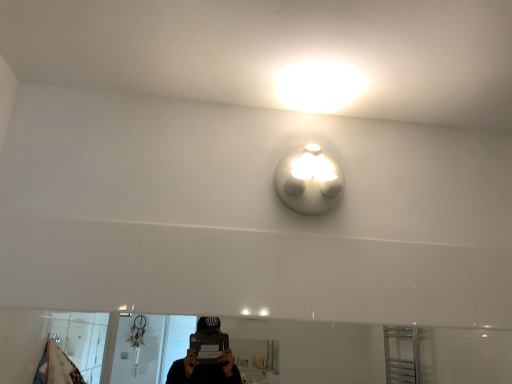
Question: From the image's perspective, is white glossy mirror at lower center below white matte light fixture at upper center?

Choices:
 (A) yes
 (B) no

Answer: (A)

Question: Can you confirm if white glossy mirror at lower center is thinner than white matte light fixture at upper center?

Choices:
 (A) no
 (B) yes

Answer: (B)

Question: From the image's perspective, is white glossy mirror at lower center over white matte light fixture at upper center?

Choices:
 (A) yes
 (B) no

Answer: (B)

Question: Does white glossy mirror at lower center have a greater width compared to white matte light fixture at upper center?

Choices:
 (A) yes
 (B) no

Answer: (B)

Question: Is white glossy mirror at lower center to the left of white matte light fixture at upper center from the viewer's perspective?

Choices:
 (A) yes
 (B) no

Answer: (A)

Question: Considering the relative sizes of white glossy mirror at lower center and white matte light fixture at upper center in the image provided, is white glossy mirror at lower center shorter than white matte light fixture at upper center?

Choices:
 (A) yes
 (B) no

Answer: (A)

Question: Is white matte light fixture at upper center shorter than white glossy mirror at lower center?

Choices:
 (A) no
 (B) yes

Answer: (A)

Question: Can you confirm if white matte light fixture at upper center is bigger than white glossy mirror at lower center?

Choices:
 (A) yes
 (B) no

Answer: (B)

Question: Can you confirm if white matte light fixture at upper center is smaller than white glossy mirror at lower center?

Choices:
 (A) no
 (B) yes

Answer: (B)

Question: Can you confirm if white matte light fixture at upper center is thinner than white glossy mirror at lower center?

Choices:
 (A) yes
 (B) no

Answer: (B)

Question: Does white matte light fixture at upper center appear on the right side of white glossy mirror at lower center?

Choices:
 (A) yes
 (B) no

Answer: (A)

Question: From a real-world perspective, is white matte light fixture at upper center positioned over white glossy mirror at lower center based on gravity?

Choices:
 (A) yes
 (B) no

Answer: (A)

Question: From the image's perspective, relative to white matte light fixture at upper center, is white glossy mirror at lower center above or below?

Choices:
 (A) above
 (B) below

Answer: (B)